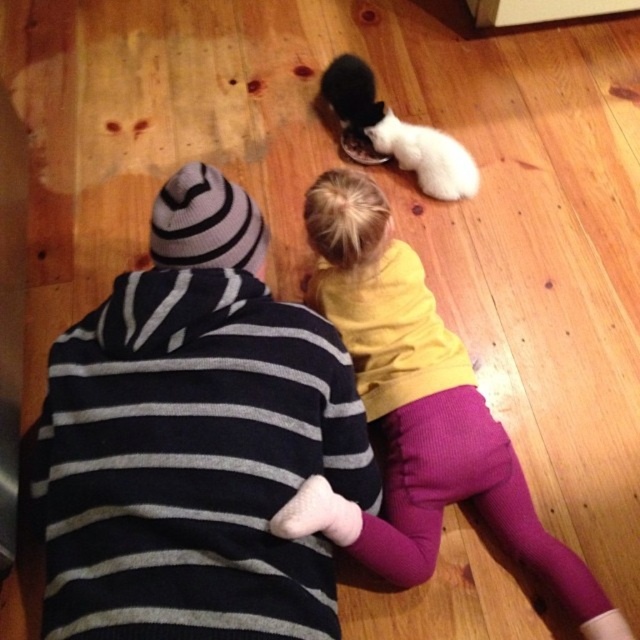
Question: Is yellow fleece shirt at center wider than black fur cat at center?

Choices:
 (A) yes
 (B) no

Answer: (A)

Question: Is yellow fleece shirt at center positioned behind black fur cat at center?

Choices:
 (A) no
 (B) yes

Answer: (A)

Question: Among these objects, which one is nearest to the camera?

Choices:
 (A) yellow fleece shirt at center
 (B) black fur cat at center

Answer: (A)

Question: Is white fluffy cat at center wider than black fur cat at center?

Choices:
 (A) no
 (B) yes

Answer: (B)

Question: Which object is farther from the camera taking this photo?

Choices:
 (A) yellow fleece shirt at center
 (B) black fur cat at center

Answer: (B)

Question: Which object is farther from the camera taking this photo?

Choices:
 (A) yellow fleece shirt at center
 (B) black fur cat at center

Answer: (B)